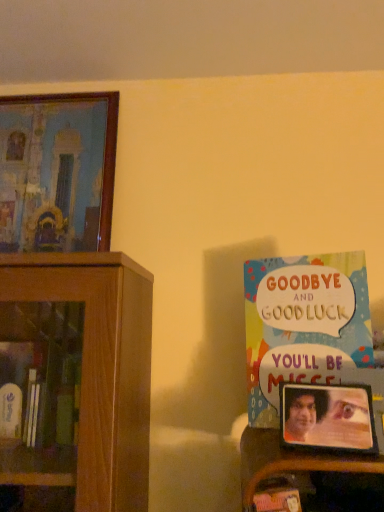
Question: Does metallic silver photo frame at right, the first picture frame from the bottom, lie in front of multicolored paper book at right?

Choices:
 (A) yes
 (B) no

Answer: (A)

Question: Is metallic silver photo frame at right, the second picture frame in the back-to-front sequence, surrounding multicolored paper book at right?

Choices:
 (A) yes
 (B) no

Answer: (B)

Question: Considering the relative sizes of metallic silver photo frame at right, the second picture frame from the top, and multicolored paper book at right in the image provided, is metallic silver photo frame at right, the second picture frame from the top, smaller than multicolored paper book at right?

Choices:
 (A) yes
 (B) no

Answer: (A)

Question: Is metallic silver photo frame at right, the second picture frame in the back-to-front sequence, outside multicolored paper book at right?

Choices:
 (A) yes
 (B) no

Answer: (A)

Question: From a real-world perspective, is metallic silver photo frame at right, the first picture frame from the bottom, physically below multicolored paper book at right?

Choices:
 (A) yes
 (B) no

Answer: (A)

Question: Is metallic silver photo frame at right, positioned as the 1th picture frame in right-to-left order, bigger than multicolored paper book at right?

Choices:
 (A) no
 (B) yes

Answer: (A)

Question: Is wooden framed painting at upper left, placed as the first picture frame when sorted from top to bottom, turned away from multicolored paper book at right?

Choices:
 (A) yes
 (B) no

Answer: (B)

Question: Is wooden framed painting at upper left, which appears as the second picture frame when ordered from the bottom, thinner than multicolored paper book at right?

Choices:
 (A) yes
 (B) no

Answer: (B)

Question: From the image's perspective, is wooden framed painting at upper left, placed as the first picture frame when sorted from top to bottom, over multicolored paper book at right?

Choices:
 (A) no
 (B) yes

Answer: (B)

Question: From a real-world perspective, does wooden framed painting at upper left, the first picture frame when ordered from back to front, sit lower than multicolored paper book at right?

Choices:
 (A) yes
 (B) no

Answer: (B)

Question: Can you confirm if wooden framed painting at upper left, the first picture frame when ordered from back to front, is wider than multicolored paper book at right?

Choices:
 (A) yes
 (B) no

Answer: (A)

Question: Is wooden framed painting at upper left, acting as the 2th picture frame starting from the front, further to camera compared to multicolored paper book at right?

Choices:
 (A) no
 (B) yes

Answer: (B)

Question: Is metallic silver photo frame at right, the first picture frame from the bottom, located outside wooden framed painting at upper left, the first picture frame when ordered from back to front?

Choices:
 (A) yes
 (B) no

Answer: (A)